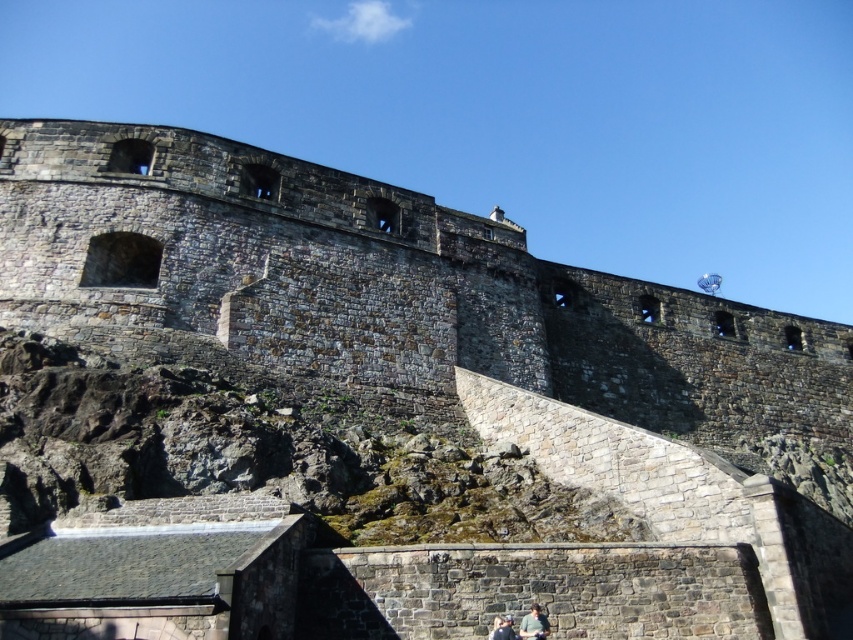
Is point (537, 630) positioned in front of point (526, 624)?

Yes, it is.

Can you confirm if matte stone couple at lower center is bigger than green fabric couple at lower center?

Correct, matte stone couple at lower center is larger in size than green fabric couple at lower center.

You are a GUI agent. You are given a task and a screenshot of the screen. Output one action in this format:
    pyautogui.click(x=<x>, y=<y>)
    Task: Click on the matte stone couple at lower center
    
    Given the screenshot: What is the action you would take?
    pyautogui.click(x=524, y=627)

The width and height of the screenshot is (853, 640). What are the coordinates of `matte stone couple at lower center` in the screenshot? It's located at (524, 627).

Does matte stone couple at lower center appear over matte black couple at lower center?

Yes.

Is point (509, 618) farther from viewer compared to point (509, 632)?

Yes, it is.

You are a GUI agent. You are given a task and a screenshot of the screen. Output one action in this format:
    pyautogui.click(x=<x>, y=<y>)
    Task: Click on the matte stone couple at lower center
    This screenshot has height=640, width=853.
    Given the screenshot: What is the action you would take?
    pyautogui.click(x=524, y=627)

How distant is green fabric couple at lower center from matte black couple at lower center?

A distance of 29.81 inches exists between green fabric couple at lower center and matte black couple at lower center.

In the scene shown: Does green fabric couple at lower center have a larger size compared to matte black couple at lower center?

Correct, green fabric couple at lower center is larger in size than matte black couple at lower center.

Describe the element at coordinates (534, 625) in the screenshot. I see `green fabric couple at lower center` at that location.

Find the location of `green fabric couple at lower center`. green fabric couple at lower center is located at coordinates click(534, 625).